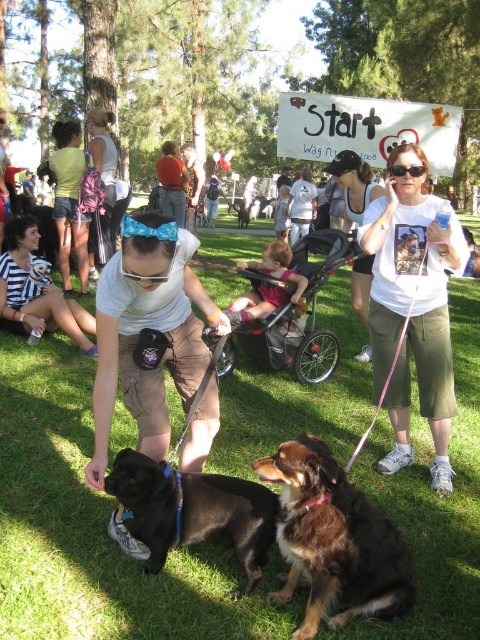
Question: Does brown shaggy dog at center appear under matte white tank top at center?

Choices:
 (A) yes
 (B) no

Answer: (A)

Question: Can you confirm if matte white tank top at center is positioned above matte pink stroller at center?

Choices:
 (A) yes
 (B) no

Answer: (A)

Question: Among these objects, which one is nearest to the camera?

Choices:
 (A) brown furry dog at center
 (B) brown shaggy dog at center
 (C) matte black dog at center

Answer: (B)

Question: Does black plastic stroller at center have a lesser width compared to matte white tank top at center?

Choices:
 (A) yes
 (B) no

Answer: (B)

Question: Which point is closer to the camera?

Choices:
 (A) matte black shirt at center
 (B) black plastic stroller at center

Answer: (B)

Question: Which object is farther from the camera taking this photo?

Choices:
 (A) white cotton t-shirt at center
 (B) green grass at center
 (C) shiny black dog at center

Answer: (B)